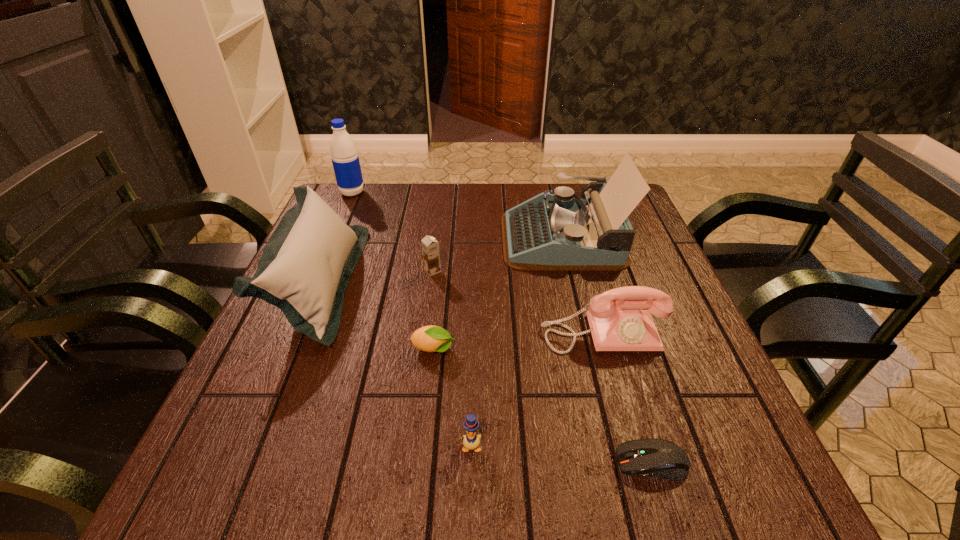
The height and width of the screenshot is (540, 960). I want to click on vacant space that is in between the chocolate milk and the typewriter, so click(497, 254).

Locate an element on the screen. unoccupied area between the telephone and the water bottle is located at coordinates (477, 264).

I want to click on vacant region between the fifth tallest object and the computer equipment, so click(x=542, y=367).

Locate an element on the screen. The width and height of the screenshot is (960, 540). vacant region between the seventh tallest object and the farthest object is located at coordinates (393, 271).

Identify the location of free spot between the computer equipment and the water bottle. Image resolution: width=960 pixels, height=540 pixels. (502, 328).

Locate an element on the screen. Image resolution: width=960 pixels, height=540 pixels. vacant area that lies between the fifth tallest object and the second shortest object is located at coordinates (433, 310).

At what (x,y) coordinates should I click in order to perform the action: click on vacant area that lies between the computer equipment and the chocolate milk. Please return your answer as a coordinate pair (x, y). Looking at the image, I should click on (542, 367).

At what (x,y) coordinates should I click in order to perform the action: click on object that stands as the fifth closest to the lemon. Please return your answer as a coordinate pair (x, y). The height and width of the screenshot is (540, 960). Looking at the image, I should click on [x=550, y=232].

Locate which object is the sixth closest to the seventh tallest object. Please provide its 2D coordinates. Your answer should be formatted as a tuple, i.e. [(x, y)], where the tuple contains the x and y coordinates of a point satisfying the conditions above.

[(659, 458)]